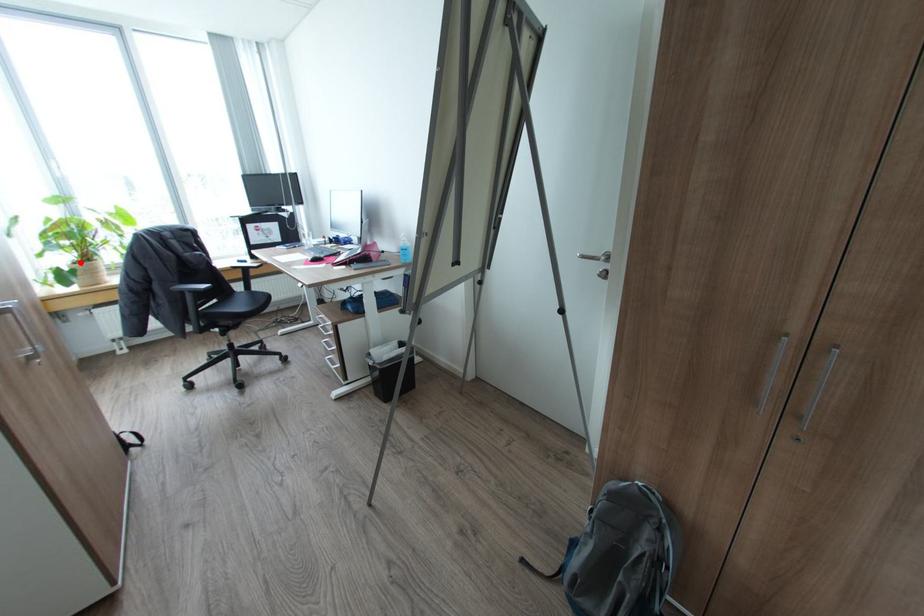
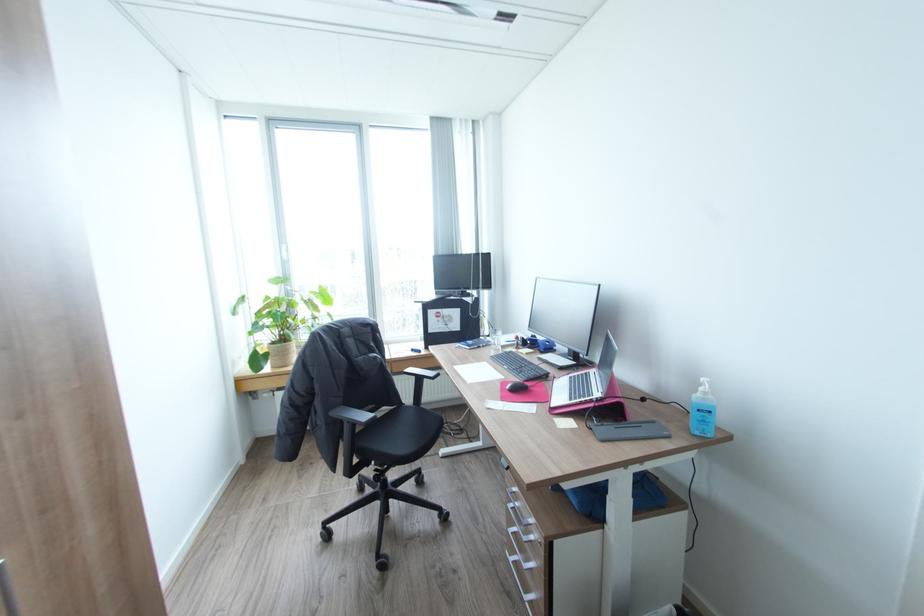
Question: I am providing you with two images of the same scene from different viewpoints. Image1 has a red point marked. In image2, the corresponding 3D location appears at what relative position? Reply with the corresponding letter.

Choices:
 (A) Closer
 (B) Farther

Answer: (A)